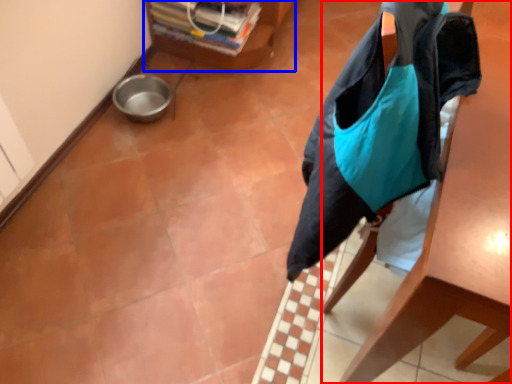
Question: Among these objects, which one is nearest to the camera, furniture (highlighted by a red box) or furniture (highlighted by a blue box)?

Choices:
 (A) furniture
 (B) furniture

Answer: (A)